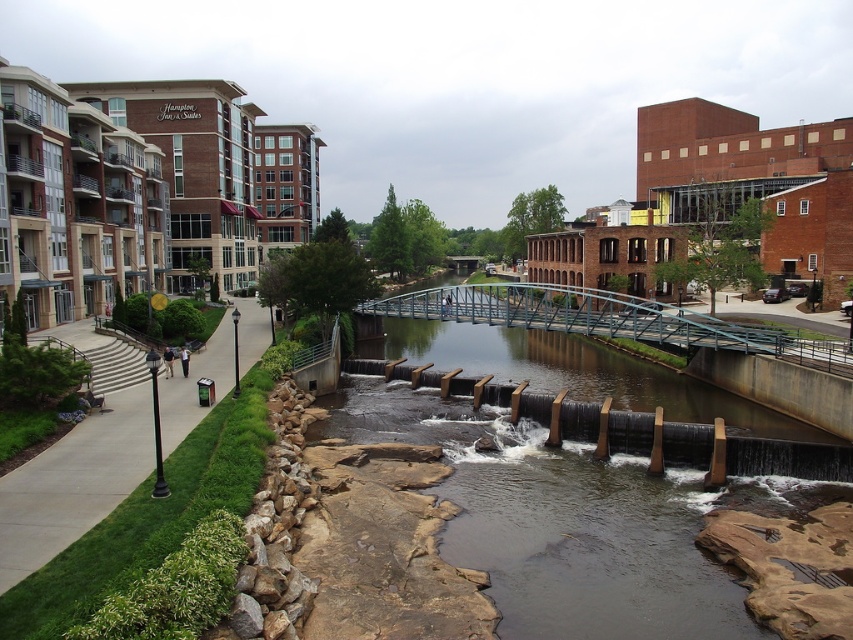
Between point (566, 579) and point (90, 452), which one is positioned behind?

Point (90, 452)

Between brown stone stream at center and green grass at left, which one appears on the left side from the viewer's perspective?

green grass at left is more to the left.

Find the location of `brown stone stream at center`. brown stone stream at center is located at coordinates (567, 531).

Find the location of a particular element. brown stone stream at center is located at coordinates (567, 531).